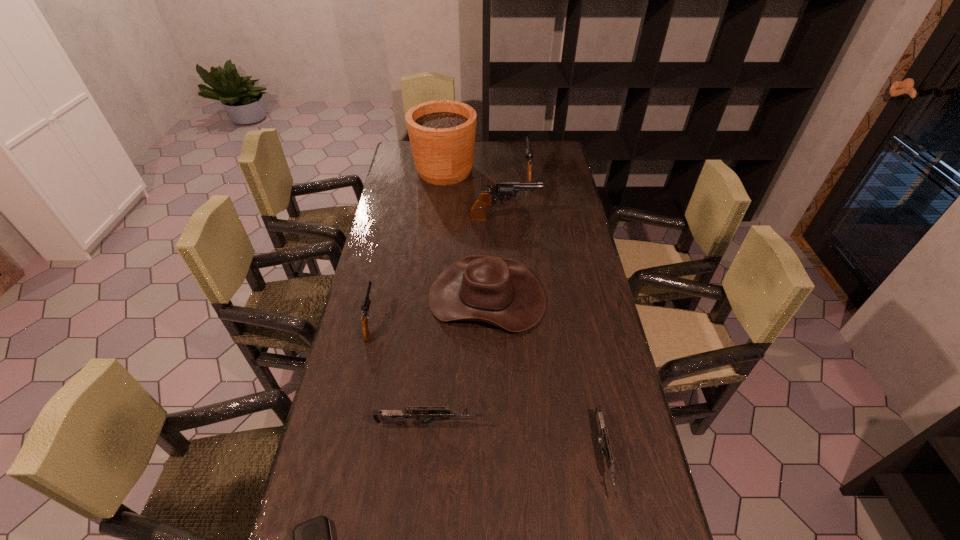
Locate an element on the screen. The height and width of the screenshot is (540, 960). flowerpot is located at coordinates (442, 133).

Identify the location of the tallest gun. (505, 191).

You are a GUI agent. You are given a task and a screenshot of the screen. Output one action in this format:
    pyautogui.click(x=<x>, y=<y>)
    Task: Click on the second farthest black gun
    
    Given the screenshot: What is the action you would take?
    pyautogui.click(x=505, y=191)

I want to click on the second tallest gun, so click(528, 152).

Where is `the second biggest black gun`? This screenshot has width=960, height=540. the second biggest black gun is located at coordinates (528, 152).

The image size is (960, 540). What are the coordinates of `cowboy hat` in the screenshot? It's located at (500, 291).

Where is `the nearest black gun`? the nearest black gun is located at coordinates (366, 301).

Locate an element on the screen. the third nearest gun is located at coordinates (366, 301).

You are a GUI agent. You are given a task and a screenshot of the screen. Output one action in this format:
    pyautogui.click(x=<x>, y=<y>)
    Task: Click on the left grey gun
    This screenshot has height=540, width=960.
    Given the screenshot: What is the action you would take?
    pyautogui.click(x=420, y=413)

Where is `the second shortest gun`? The width and height of the screenshot is (960, 540). the second shortest gun is located at coordinates pos(420,413).